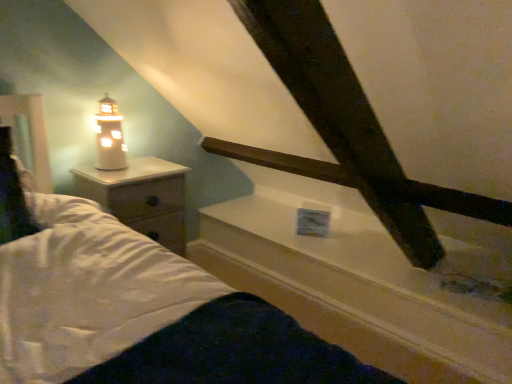
Question: Is point (109, 119) positioned closer to the camera than point (154, 205)?

Choices:
 (A) farther
 (B) closer

Answer: (B)

Question: From the image's perspective, is white ceramic lighthouse at left above or below white wood nightstand at left?

Choices:
 (A) above
 (B) below

Answer: (A)

Question: Which object is positioned farthest from the white glossy window sill at upper center?

Choices:
 (A) white wood nightstand at left
 (B) white ceramic lighthouse at left

Answer: (B)

Question: Considering the real-world distances, which object is farthest from the white ceramic lighthouse at left?

Choices:
 (A) white glossy window sill at upper center
 (B) white wood nightstand at left

Answer: (A)